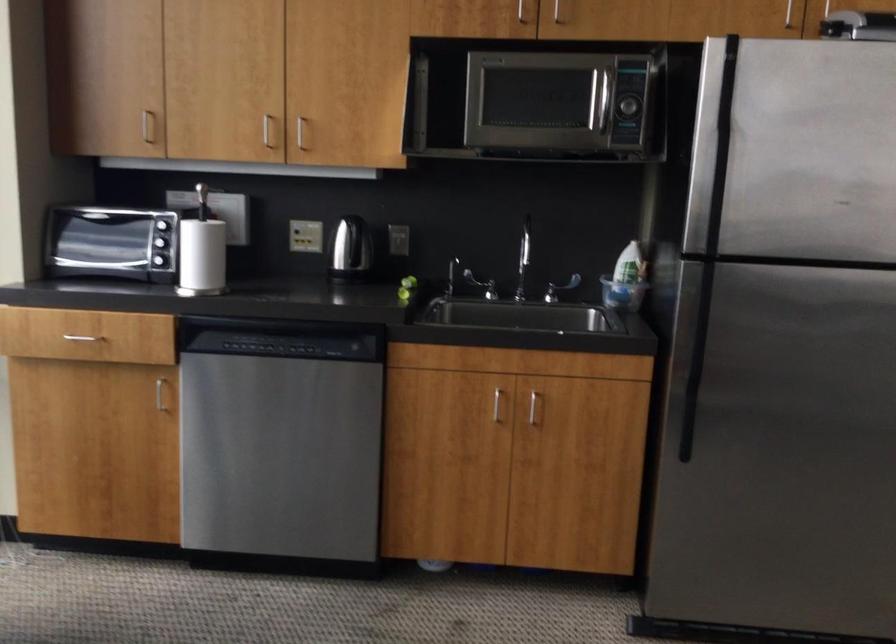
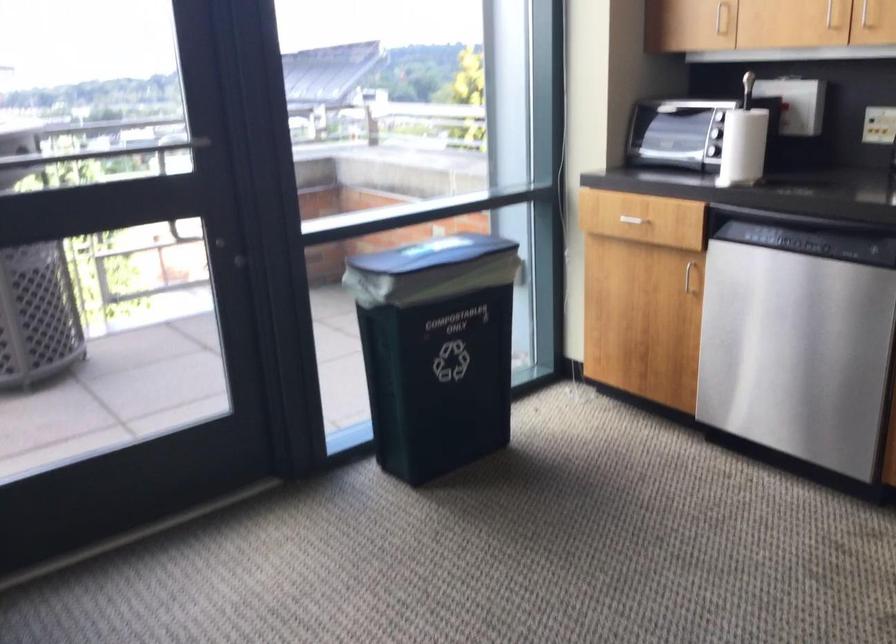
Find the pixel in the second image that matches (151,125) in the first image.

(721, 17)